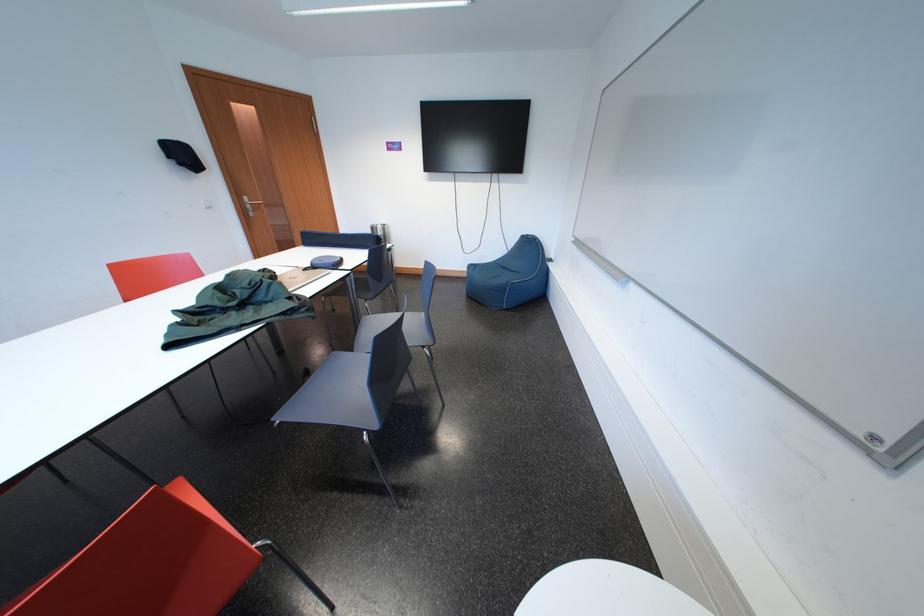
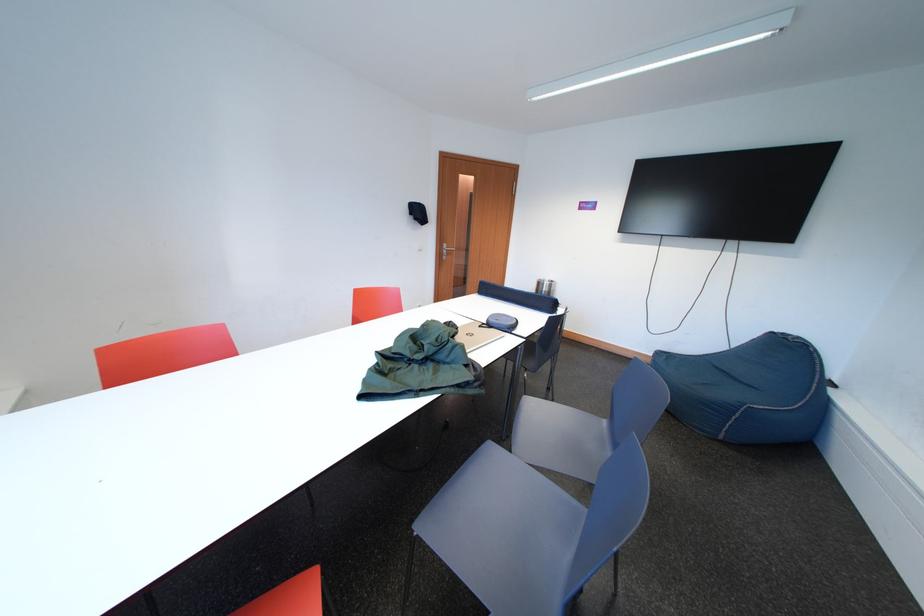
In the second image, find the point that corresponds to pixel 287 423 in the first image.

(429, 532)